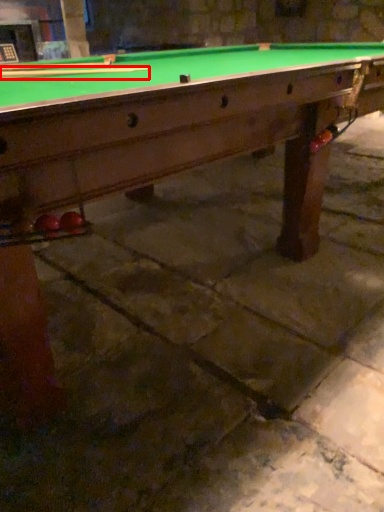
Question: From the image's perspective, what is the correct spatial relationship of cue (annotated by the red box) in relation to cue?

Choices:
 (A) below
 (B) above

Answer: (A)